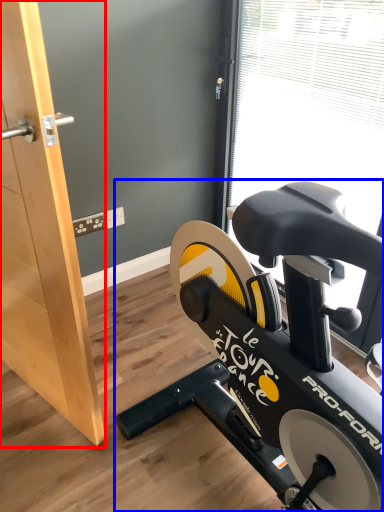
Question: Which of the following is the farthest to the observer, screen door (highlighted by a red box) or stationary bicycle (highlighted by a blue box)?

Choices:
 (A) screen door
 (B) stationary bicycle

Answer: (B)